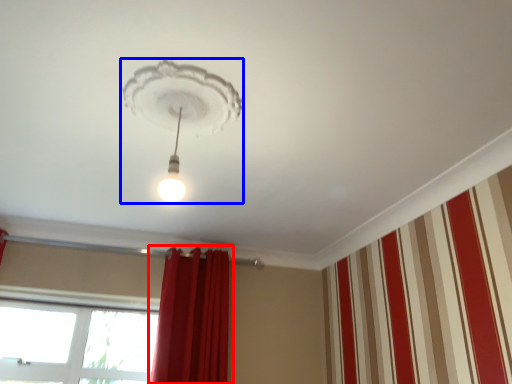
Question: Among these objects, which one is farthest to the camera, curtain (highlighted by a red box) or lamp (highlighted by a blue box)?

Choices:
 (A) curtain
 (B) lamp

Answer: (A)